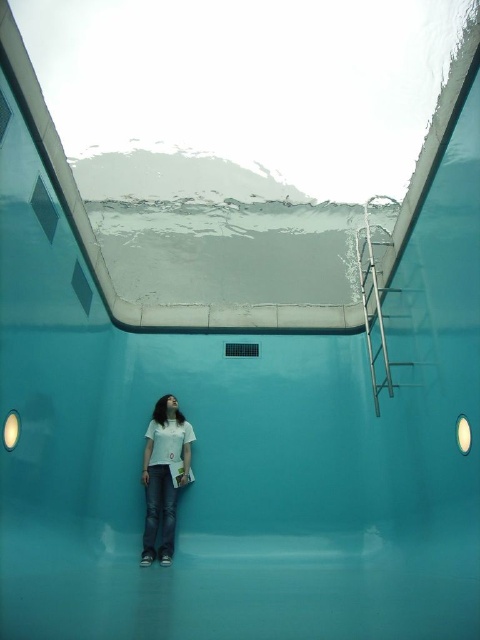
How far apart are metallic silver ladder at upper right and white matte shirt at center?

metallic silver ladder at upper right is 7.95 feet from white matte shirt at center.

Can you confirm if metallic silver ladder at upper right is positioned to the right of white matte shirt at center?

Correct, you'll find metallic silver ladder at upper right to the right of white matte shirt at center.

This screenshot has width=480, height=640. What do you see at coordinates (377, 296) in the screenshot?
I see `metallic silver ladder at upper right` at bounding box center [377, 296].

Locate an element on the screen. This screenshot has height=640, width=480. metallic silver ladder at upper right is located at coordinates (377, 296).